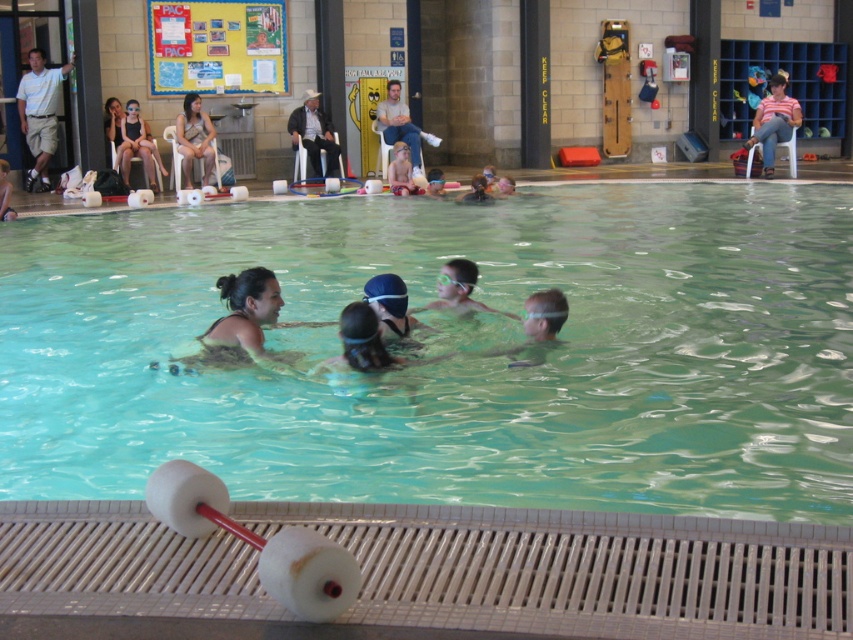
Question: Can you confirm if smooth skin woman at center is positioned above light blue shirt at upper left?

Choices:
 (A) no
 (B) yes

Answer: (A)

Question: Does light brown leather jacket at upper center appear on the left side of matte beige swimsuit at upper left?

Choices:
 (A) no
 (B) yes

Answer: (A)

Question: Considering the relative positions of clear plastic pool at center and matte beige swimsuit at upper left in the image provided, where is clear plastic pool at center located with respect to matte beige swimsuit at upper left?

Choices:
 (A) left
 (B) right

Answer: (B)

Question: Which point is farther from the camera taking this photo?

Choices:
 (A) (3, 262)
 (B) (151, 170)

Answer: (B)

Question: Which point is closer to the camera?

Choices:
 (A) matte black swimsuit at upper left
 (B) light brown leather jacket at upper center
 (C) striped shirt at upper right

Answer: (A)

Question: Which object is the closest to the light blue shirt at upper left?

Choices:
 (A) matte black swimsuit at upper left
 (B) matte black swim cap at upper center
 (C) striped shirt at upper right

Answer: (A)